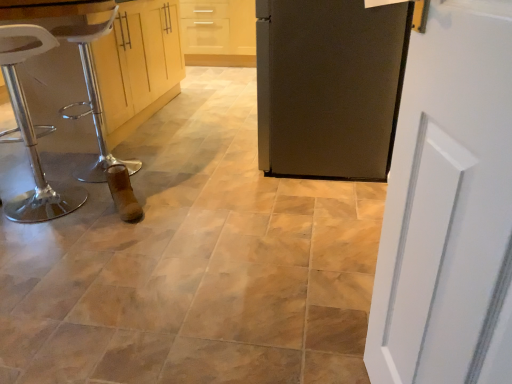
Locate an element on the screen. free spot to the right of white plastic stool at left is located at coordinates (104, 208).